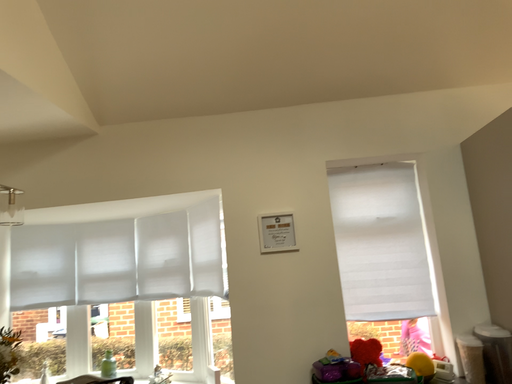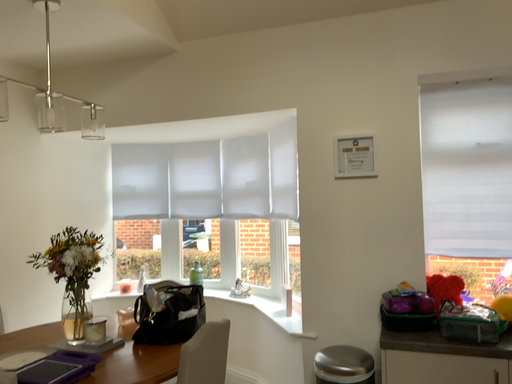
Question: How did the camera likely rotate when shooting the video?

Choices:
 (A) rotated downward
 (B) rotated upward

Answer: (A)